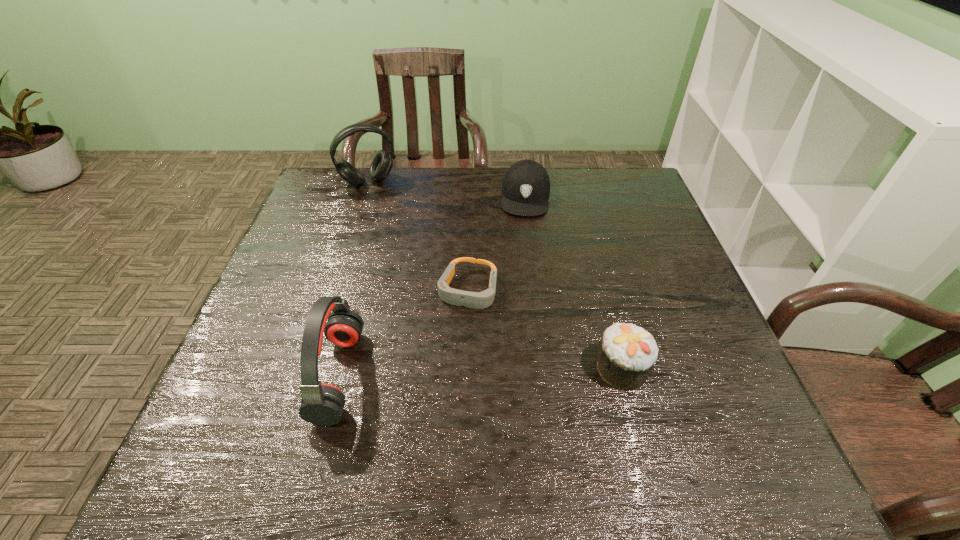
Identify the location of free spot between the rightmost object and the earphone. The height and width of the screenshot is (540, 960). (480, 372).

You are a GUI agent. You are given a task and a screenshot of the screen. Output one action in this format:
    pyautogui.click(x=<x>, y=<y>)
    Task: Click on the vacant space that is in between the second object from right to left and the cupcake
    This screenshot has width=960, height=540.
    Given the screenshot: What is the action you would take?
    pyautogui.click(x=573, y=282)

Locate an element on the screen. The height and width of the screenshot is (540, 960). vacant area between the cupcake and the third object from left to right is located at coordinates (544, 329).

Identify the location of unoccupied position between the cap and the headset. (447, 190).

Identify the location of free space between the earphone and the headset. Image resolution: width=960 pixels, height=540 pixels. (353, 279).

At what (x,y) coordinates should I click in order to perform the action: click on free area in between the earphone and the rightmost object. Please return your answer as a coordinate pair (x, y). This screenshot has width=960, height=540. Looking at the image, I should click on (480, 372).

This screenshot has width=960, height=540. Find the location of `free space between the earphone and the third object from right to left`. free space between the earphone and the third object from right to left is located at coordinates (403, 333).

Locate an element on the screen. vacant space that is in between the rightmost object and the goggles is located at coordinates (544, 329).

This screenshot has height=540, width=960. In order to click on vacant space that is in between the headset and the earphone in this screenshot , I will do `click(353, 279)`.

Image resolution: width=960 pixels, height=540 pixels. I want to click on the third closest object to the cupcake, so click(x=322, y=404).